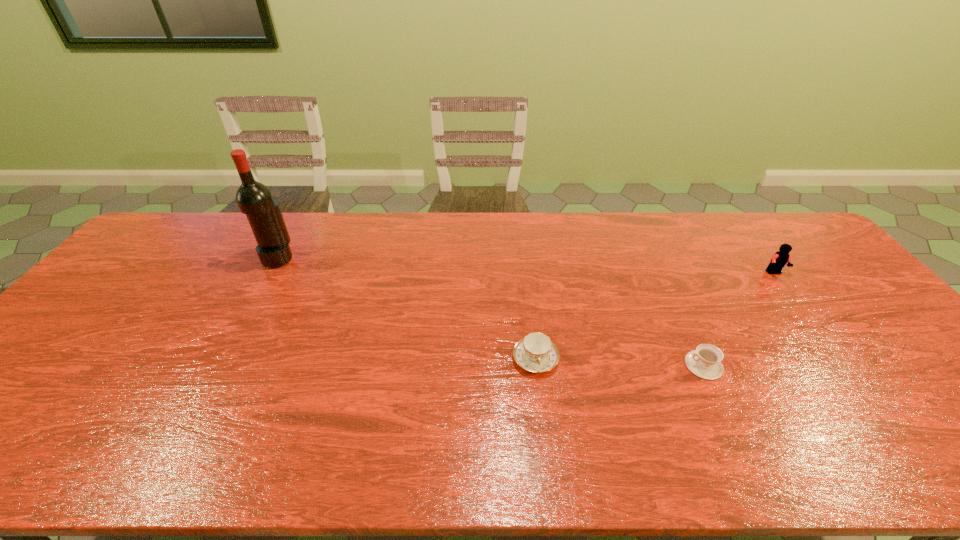
You are a GUI agent. You are given a task and a screenshot of the screen. Output one action in this format:
    pyautogui.click(x=<x>, y=<y>)
    Task: Click on the empty space that is in between the leftmost object and the right teacup
    This screenshot has height=540, width=960.
    Given the screenshot: What is the action you would take?
    pyautogui.click(x=491, y=312)

This screenshot has height=540, width=960. I want to click on free space between the shortest object and the leftmost object, so click(x=491, y=312).

You are a GUI agent. You are given a task and a screenshot of the screen. Output one action in this format:
    pyautogui.click(x=<x>, y=<y>)
    Task: Click on the empty location between the tallest object and the shorter teacup
    This screenshot has width=960, height=540.
    Given the screenshot: What is the action you would take?
    pyautogui.click(x=491, y=312)

Find the location of a particular element. This screenshot has width=960, height=540. vacant area that lies between the wine bottle and the rightmost object is located at coordinates (526, 265).

Locate an element on the screen. The width and height of the screenshot is (960, 540). free space between the right teacup and the rightmost object is located at coordinates tap(739, 319).

The image size is (960, 540). I want to click on free point between the taller teacup and the second tallest object, so click(655, 316).

This screenshot has width=960, height=540. In order to click on free spot between the shorter teacup and the second tallest object in this screenshot , I will do `click(739, 319)`.

I want to click on vacant area that lies between the tallest object and the second object from left to right, so click(407, 308).

I want to click on free space between the shortest object and the rightmost object, so click(x=739, y=319).

This screenshot has width=960, height=540. I want to click on empty space between the third tallest object and the shortest object, so click(x=619, y=362).